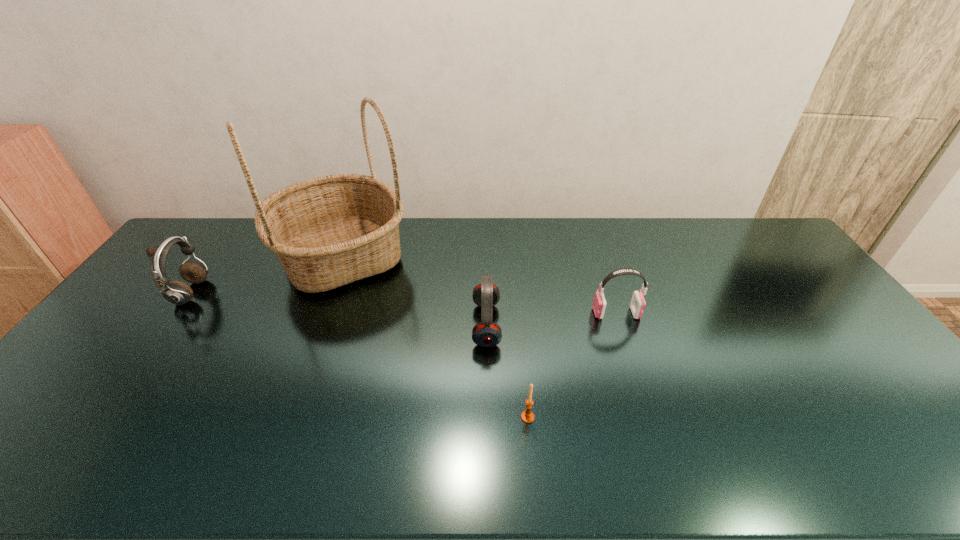
Identify the location of the tallest object. (329, 231).

Image resolution: width=960 pixels, height=540 pixels. I want to click on the fourth object from right to left, so pos(329,231).

You are a GUI agent. You are given a task and a screenshot of the screen. Output one action in this format:
    pyautogui.click(x=<x>, y=<y>)
    Task: Click on the tallest earphone
    
    Given the screenshot: What is the action you would take?
    pyautogui.click(x=176, y=292)

Locate an element on the screen. the leftmost earphone is located at coordinates (176, 292).

At what (x,y) coordinates should I click in order to perform the action: click on the rightmost object. Please return your answer as a coordinate pair (x, y). Looking at the image, I should click on (637, 305).

You are a GUI agent. You are given a task and a screenshot of the screen. Output one action in this format:
    pyautogui.click(x=<x>, y=<y>)
    Task: Click on the second earphone from left to right
    
    Given the screenshot: What is the action you would take?
    pyautogui.click(x=486, y=295)

Where is `the fourth object from left to right`? the fourth object from left to right is located at coordinates (527, 416).

The height and width of the screenshot is (540, 960). I want to click on the nearest object, so click(x=527, y=416).

I want to click on free location located 0.100m on the right of the second object from left to right, so click(x=439, y=257).

The height and width of the screenshot is (540, 960). I want to click on free space located 0.100m on the ear pads of the leftmost object, so click(235, 293).